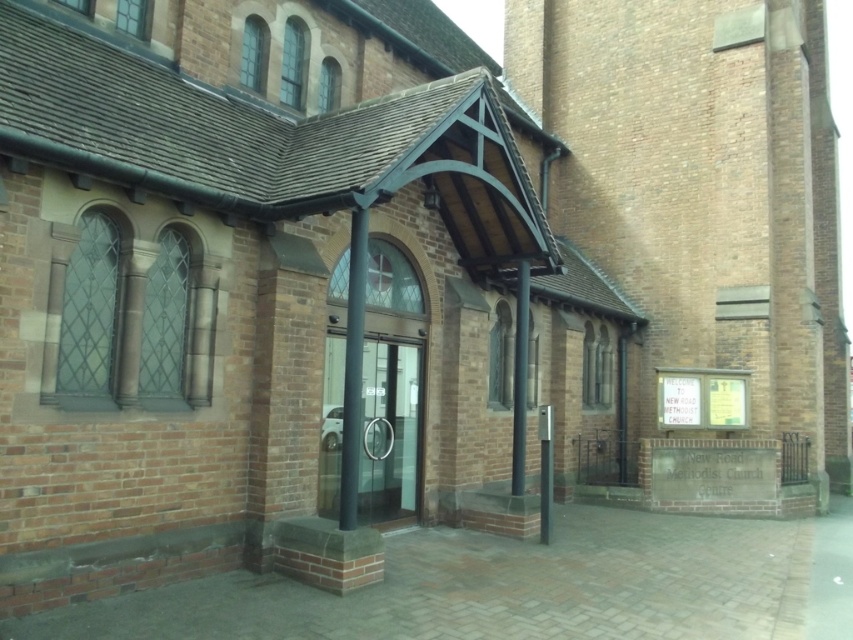
From the picture: Who is positioned more to the right, clear glass door at center or black smooth pole at center?

Positioned to the right is clear glass door at center.

Between point (389, 492) and point (363, 305), which one is positioned in front?

Point (363, 305)

Who is more distant from viewer, (373, 385) or (352, 451)?

Point (373, 385)

Image resolution: width=853 pixels, height=640 pixels. What are the coordinates of `clear glass door at center` in the screenshot? It's located at (389, 432).

Between point (355, 499) and point (519, 442), which one is positioned in front?

Point (355, 499) is more forward.

Between black smooth pole at center and metallic pole at center, which one appears on the right side from the viewer's perspective?

From the viewer's perspective, metallic pole at center appears more on the right side.

Image resolution: width=853 pixels, height=640 pixels. What are the coordinates of `black smooth pole at center` in the screenshot? It's located at (352, 371).

Where is `black smooth pole at center`? The image size is (853, 640). black smooth pole at center is located at coordinates (352, 371).

Is clear glass door at center further to camera compared to metallic pole at center?

No, it is in front of metallic pole at center.

Does clear glass door at center come in front of metallic pole at center?

Yes, clear glass door at center is closer to the viewer.

Measure the distance between point (338, 339) and camera.

A distance of 9.55 meters exists between point (338, 339) and camera.

At what (x,y) coordinates should I click in order to perform the action: click on clear glass door at center. Please return your answer as a coordinate pair (x, y). Looking at the image, I should click on (389, 432).